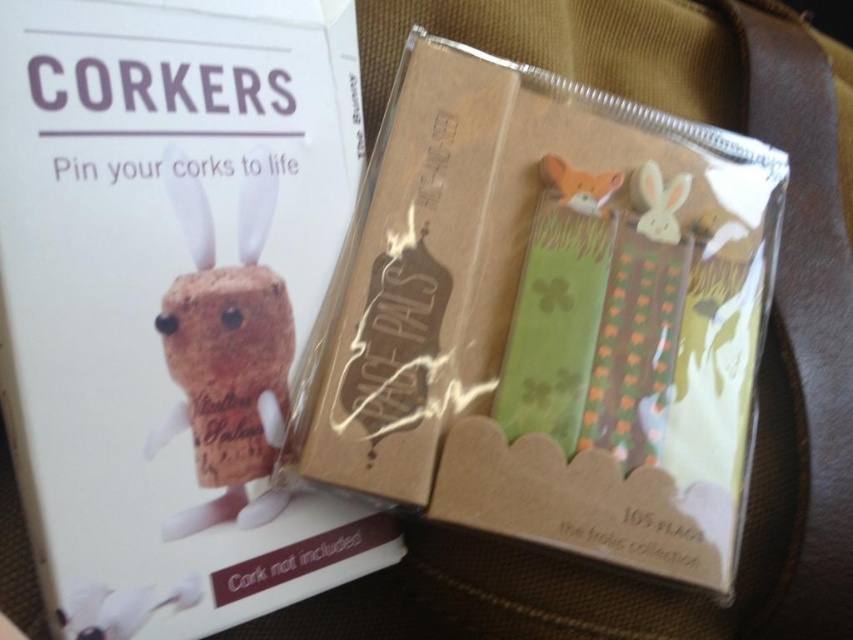
Is matte white bunny at lower left to the left of white matte bunny at upper right from the viewer's perspective?

Yes, matte white bunny at lower left is to the left of white matte bunny at upper right.

Which is more to the left, matte white bunny at lower left or white matte bunny at upper right?

matte white bunny at lower left

Does point (77, 627) come behind point (669, 241)?

That is False.

Locate an element on the screen. Image resolution: width=853 pixels, height=640 pixels. matte white bunny at lower left is located at coordinates (122, 608).

Where is `matte brown cork at upper left`? Image resolution: width=853 pixels, height=640 pixels. matte brown cork at upper left is located at coordinates (173, 292).

Does matte brown cork at upper left have a larger size compared to white matte bunny at upper right?

Yes.

Between point (161, 536) and point (676, 224), which one is positioned behind?

The point (676, 224) is more distant.

Identify the location of matte brown cork at upper left. The width and height of the screenshot is (853, 640). (173, 292).

Between matte brown cork at upper left and matte white bunny at lower left, which one appears on the right side from the viewer's perspective?

matte brown cork at upper left is more to the right.

Does matte brown cork at upper left appear on the right side of matte white bunny at lower left?

Indeed, matte brown cork at upper left is positioned on the right side of matte white bunny at lower left.

Is point (204, 38) behind point (106, 620)?

Yes, it is behind point (106, 620).

Identify the location of matte brown cork at upper left. The height and width of the screenshot is (640, 853). (173, 292).